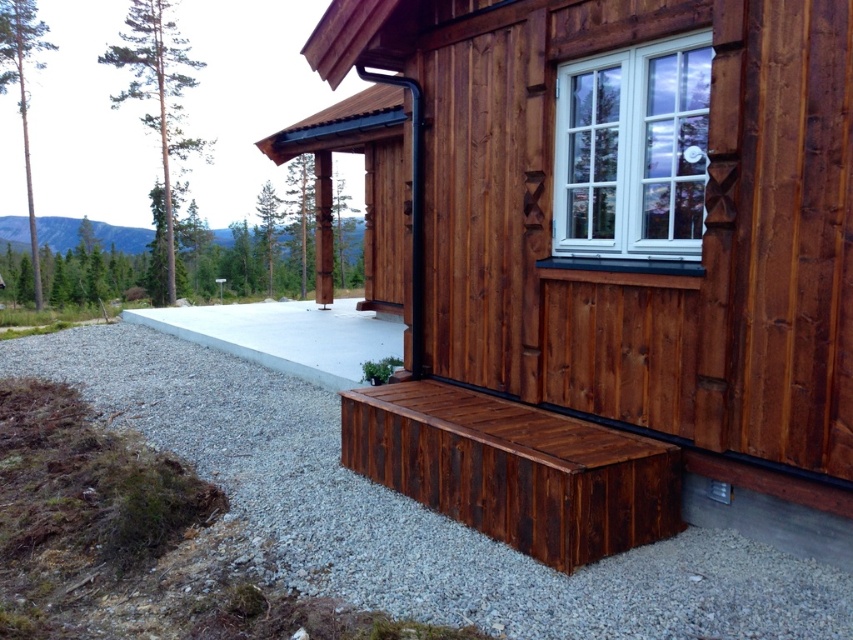
You are planning to place a new garden statue that is 1.2 meters wide in your cabin area. The dark brown wood bench at lower right and the white plastic window at upper center are already present. Which object can the statue be placed next to without exceeding its width?

The dark brown wood bench at lower right is bigger than the white plastic window at upper center, so the statue can be placed next to the dark brown wood bench at lower right since it has more space available.